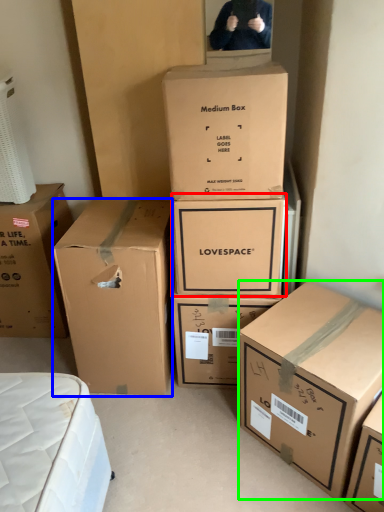
Question: Which object is the farthest from box (highlighted by a red box)? Choose among these: box (highlighted by a blue box) or box (highlighted by a green box).

Choices:
 (A) box
 (B) box

Answer: (B)